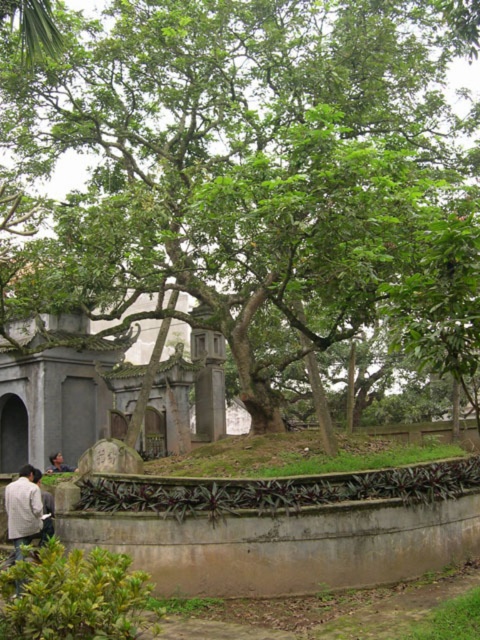
You are standing at the center of the image. Which direction should you move to get closer to the green leafy tree at center?

Since the green leafy tree at center is already at the center of the image, you don not need to move in any direction to get closer to it.

You are a painter standing at the base of the large tree. You want to paint the white cotton shirt at lower left and the light brown wooden head at center. Since you have a limited amount of paint, you need to know which object is closer to you to prioritize. Can you determine which one is nearer?

The distance between the white cotton shirt at lower left and the light brown wooden head at center is 16.88 meters. However, without additional information about their individual distances from your current position, it is impossible to determine which is closer.

You are standing in a garden area enclosed by a low concrete wall with curved top. You notice two items at the lower left corner of the scene. Which item is positioned lower between the light brown leather jacket at lower left and the white cotton shirt at lower left?

The light brown leather jacket at lower left is located below the white cotton shirt at lower left, so it is positioned lower.